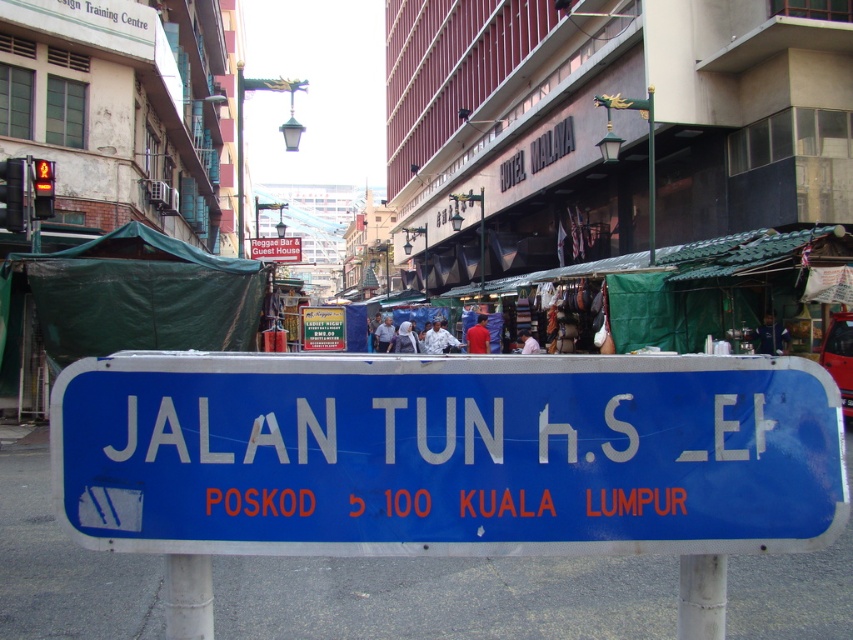
Is blue metallic sign at center to the left of blue plastic sign at center from the viewer's perspective?

Incorrect, blue metallic sign at center is not on the left side of blue plastic sign at center.

Does point (120, 404) come in front of point (273, 244)?

Yes.

This screenshot has height=640, width=853. I want to click on blue metallic sign at center, so click(447, 452).

Image resolution: width=853 pixels, height=640 pixels. I want to click on white fabric at center, so click(433, 317).

Who is taller, white fabric at center or blue plastic sign at center?

With more height is blue plastic sign at center.

Describe the element at coordinates (433, 317) in the screenshot. I see `white fabric at center` at that location.

In order to click on white fabric at center in this screenshot , I will do `click(433, 317)`.

Does blue metallic sign at center have a smaller size compared to white fabric at center?

Yes.

Does blue metallic sign at center appear on the left side of white fabric at center?

Incorrect, blue metallic sign at center is not on the left side of white fabric at center.

What do you see at coordinates (447, 452) in the screenshot?
I see `blue metallic sign at center` at bounding box center [447, 452].

At what (x,y) coordinates should I click in order to perform the action: click on blue metallic sign at center. Please return your answer as a coordinate pair (x, y). The height and width of the screenshot is (640, 853). Looking at the image, I should click on (447, 452).